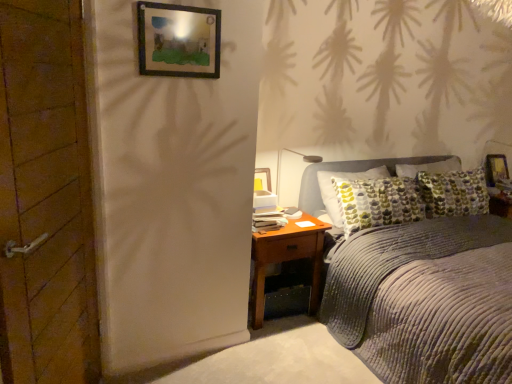
This screenshot has width=512, height=384. I want to click on blank space above wooden picture frame at upper right, placed as the 2th picture frame when sorted from left to right (from a real-world perspective), so click(x=499, y=157).